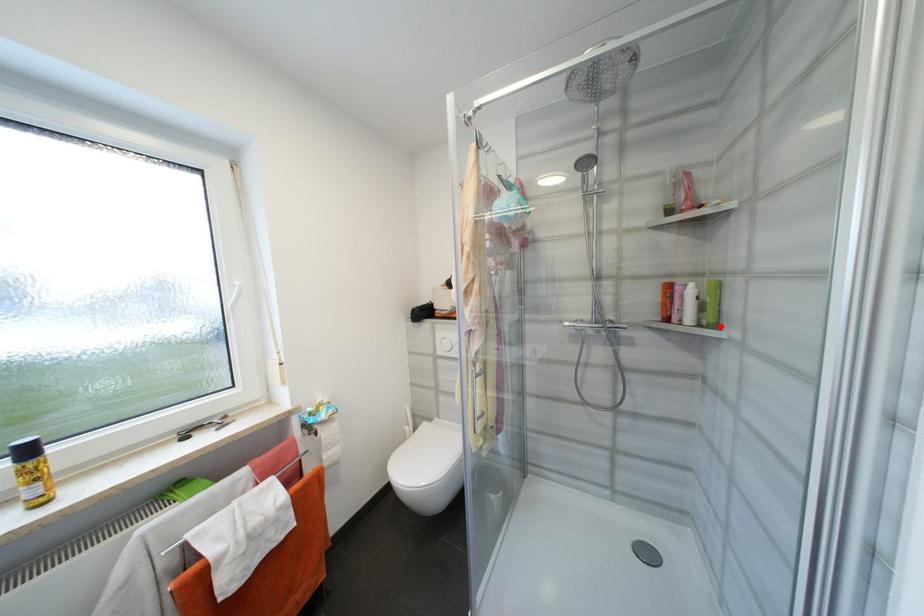
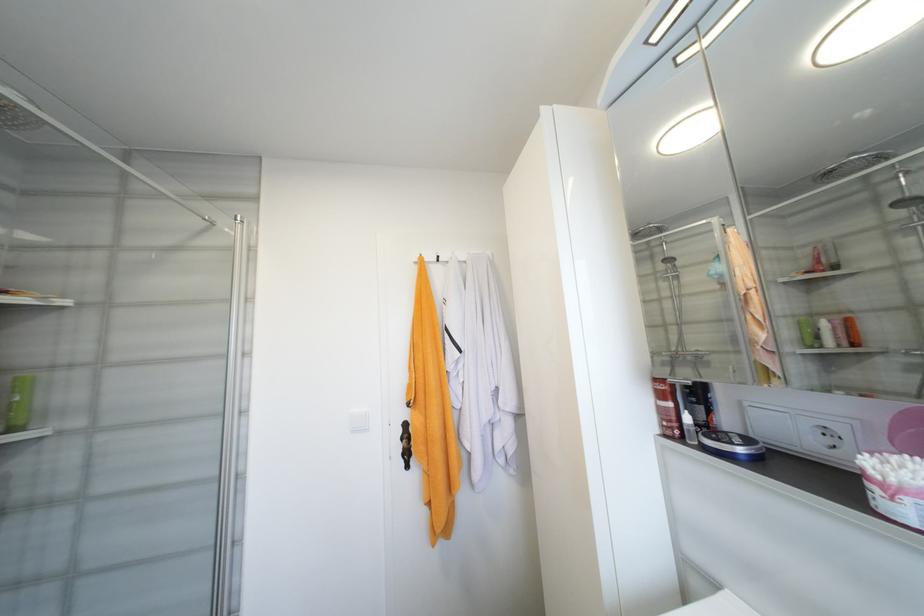
Question: I am providing you with two images of the same scene from different viewpoints. Image1 has a red point marked. In image2, the corresponding 3D location appears at what relative position? Reply with the corresponding letter.

Choices:
 (A) Closer
 (B) Farther

Answer: (A)